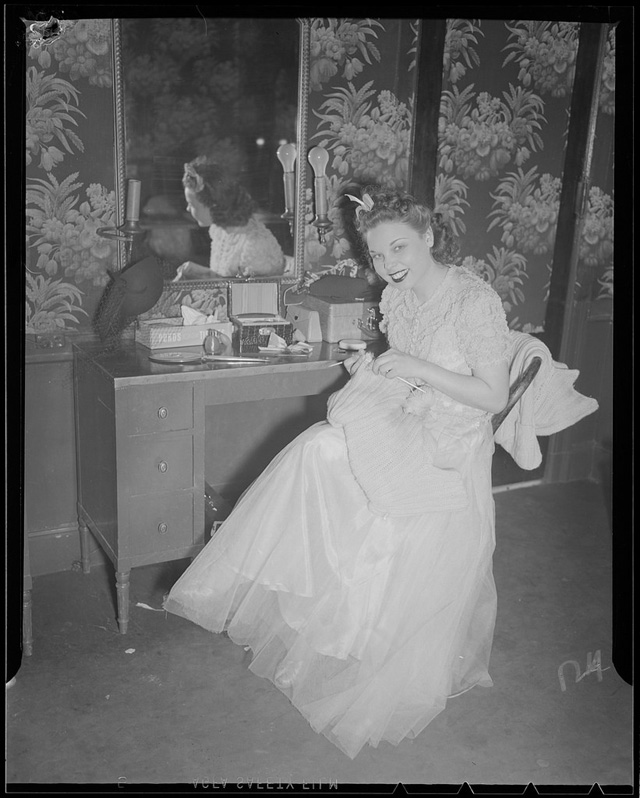
The width and height of the screenshot is (640, 798). Find the location of `desk`. desk is located at coordinates (198, 457).